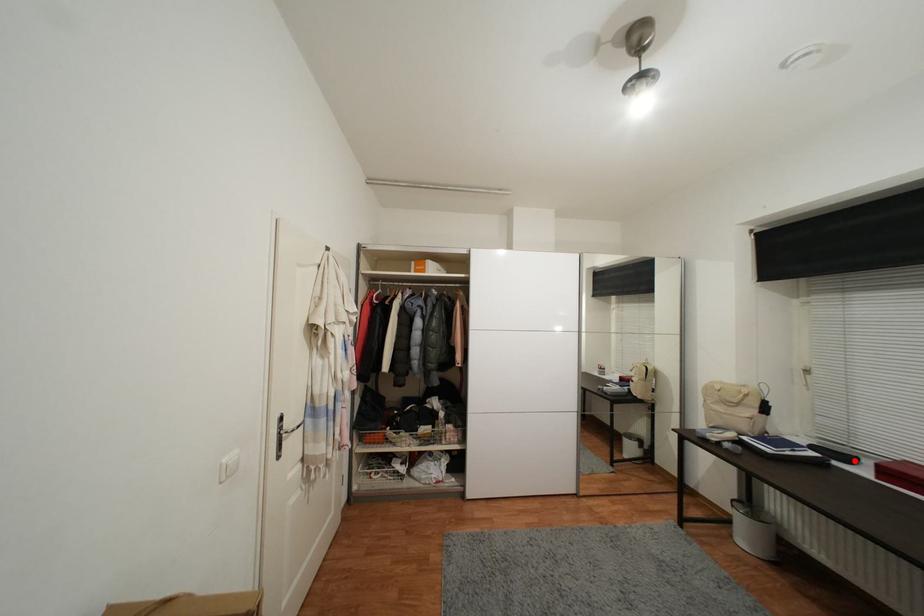
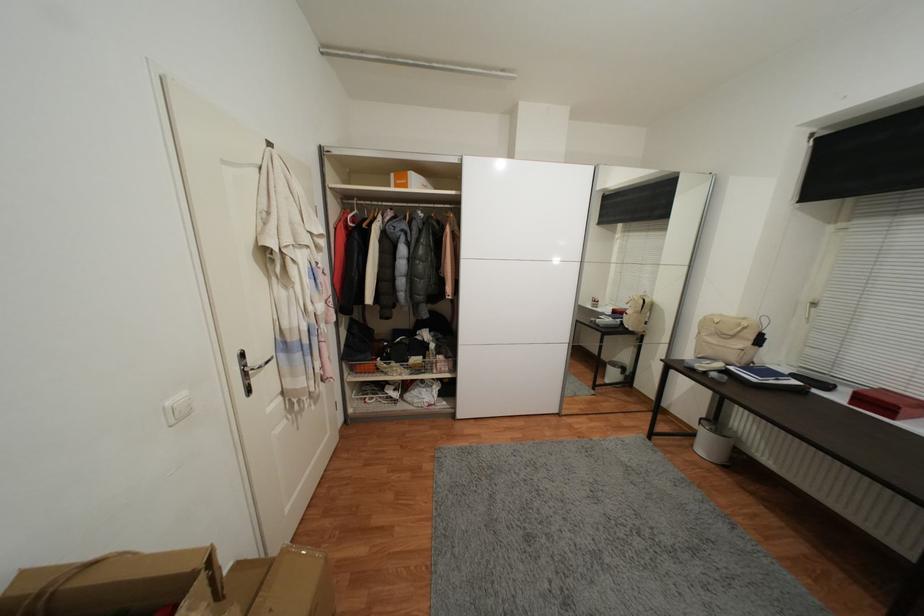
The point at the highlighted location is marked in the first image. Where is the corresponding point in the second image?

(831, 387)